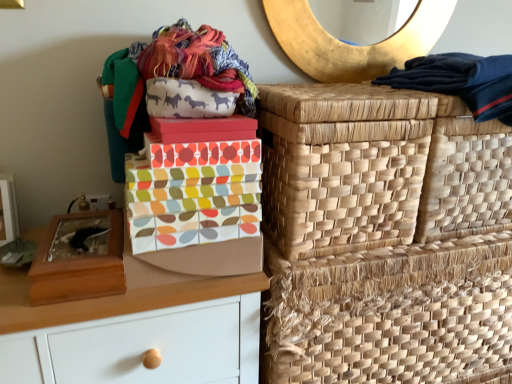
What do you see at coordinates (353, 46) in the screenshot? I see `gold textured mirror at upper center` at bounding box center [353, 46].

Identify the location of matte brown chest of drawers at left. (133, 333).

Find the location of a particular element. The width and height of the screenshot is (512, 384). dark blue fabric at upper right is located at coordinates 461,81.

What do you see at coordinates (198, 197) in the screenshot? I see `multicolored fabric shoe box at center, which is the second shoe box from left to right` at bounding box center [198, 197].

Describe the element at coordinates (465, 176) in the screenshot. I see `natural woven basket at upper right, placed as the 3th basket when sorted from bottom to top` at that location.

This screenshot has height=384, width=512. I want to click on natural woven basket at right, which is counted as the second basket, starting from the top, so click(x=342, y=165).

What do you see at coordinates (79, 260) in the screenshot? I see `wooden shoe box at left, the 2th shoe box in the right-to-left sequence` at bounding box center [79, 260].

Identify the location of wooden shoe box at left, which appears as the 1th shoe box when viewed from the left. The height and width of the screenshot is (384, 512). (79, 260).

What is the approximate height of natural woven basket at right, the 1th basket ordered from the bottom?

natural woven basket at right, the 1th basket ordered from the bottom, is 17.76 inches tall.

Identify the location of gold textured mirror at upper center. The image size is (512, 384). (353, 46).

From a real-world perspective, is matte brown chest of drawers at left physically located above or below natural woven basket at right, placed as the third basket when sorted from top to bottom?

matte brown chest of drawers at left is below natural woven basket at right, placed as the third basket when sorted from top to bottom.

Considering the relative sizes of matte brown chest of drawers at left and natural woven basket at right, the 1th basket ordered from the bottom, in the image provided, is matte brown chest of drawers at left smaller than natural woven basket at right, the 1th basket ordered from the bottom,?

Incorrect, matte brown chest of drawers at left is not smaller in size than natural woven basket at right, the 1th basket ordered from the bottom.

Do you think matte brown chest of drawers at left is within natural woven basket at right, placed as the third basket when sorted from top to bottom, or outside of it?

matte brown chest of drawers at left cannot be found inside natural woven basket at right, placed as the third basket when sorted from top to bottom.

Could you tell me if matte brown chest of drawers at left is facing natural woven basket at right, which ranks as the second basket in bottom-to-top order?

No, matte brown chest of drawers at left is not facing towards natural woven basket at right, which ranks as the second basket in bottom-to-top order.

Is matte brown chest of drawers at left bigger than natural woven basket at right, which ranks as the second basket in bottom-to-top order?

Indeed, matte brown chest of drawers at left has a larger size compared to natural woven basket at right, which ranks as the second basket in bottom-to-top order.

Considering the relative sizes of matte brown chest of drawers at left and natural woven basket at right, which is counted as the second basket, starting from the top, in the image provided, is matte brown chest of drawers at left thinner than natural woven basket at right, which is counted as the second basket, starting from the top,?

Incorrect, the width of matte brown chest of drawers at left is not less than that of natural woven basket at right, which is counted as the second basket, starting from the top.

From a real-world perspective, is matte brown chest of drawers at left above or below natural woven basket at right, which is counted as the second basket, starting from the top?

In terms of real-world spatial position, matte brown chest of drawers at left is below natural woven basket at right, which is counted as the second basket, starting from the top.

Is the surface of natural woven basket at right, placed as the third basket when sorted from top to bottom, in direct contact with matte brown chest of drawers at left?

No, natural woven basket at right, placed as the third basket when sorted from top to bottom, is not next to matte brown chest of drawers at left.

Can you confirm if natural woven basket at right, placed as the third basket when sorted from top to bottom, is positioned to the right of matte brown chest of drawers at left?

Indeed, natural woven basket at right, placed as the third basket when sorted from top to bottom, is positioned on the right side of matte brown chest of drawers at left.

Which of these two, natural woven basket at right, the 1th basket ordered from the bottom, or matte brown chest of drawers at left, is wider?

With larger width is natural woven basket at right, the 1th basket ordered from the bottom.

Is point (468, 367) positioned in front of point (106, 338)?

No, (468, 367) is further to viewer.

Looking at this image, is multicolored fabric shoe box at center, the first shoe box viewed from the right, with natural woven basket at right, the 1th basket ordered from the bottom?

No, multicolored fabric shoe box at center, the first shoe box viewed from the right, is not in contact with natural woven basket at right, the 1th basket ordered from the bottom.

Is point (259, 171) closer to camera compared to point (279, 295)?

That is True.

In terms of width, does multicolored fabric shoe box at center, which is the second shoe box from left to right, look wider or thinner when compared to natural woven basket at right, placed as the third basket when sorted from top to bottom?

In the image, multicolored fabric shoe box at center, which is the second shoe box from left to right, appears to be more narrow than natural woven basket at right, placed as the third basket when sorted from top to bottom.

Is dark blue fabric at upper right to the right of natural woven basket at right, placed as the third basket when sorted from top to bottom, from the viewer's perspective?

Correct, you'll find dark blue fabric at upper right to the right of natural woven basket at right, placed as the third basket when sorted from top to bottom.

There is a natural woven basket at right, the 1th basket ordered from the bottom. Where is `clothing above it (from a real-world perspective)`? clothing above it (from a real-world perspective) is located at coordinates (461, 81).

Who is taller, dark blue fabric at upper right or natural woven basket at right, placed as the third basket when sorted from top to bottom?

With more height is natural woven basket at right, placed as the third basket when sorted from top to bottom.

Find the location of a particular element. The height and width of the screenshot is (384, 512). the 1st shoe box counting from the left side of the gold textured mirror at upper center is located at coordinates (198, 197).

Can we say multicolored fabric shoe box at center, which is the second shoe box from left to right, lies outside gold textured mirror at upper center?

That's correct, multicolored fabric shoe box at center, which is the second shoe box from left to right, is outside of gold textured mirror at upper center.

Is multicolored fabric shoe box at center, the first shoe box viewed from the right, smaller than gold textured mirror at upper center?

Incorrect, multicolored fabric shoe box at center, the first shoe box viewed from the right, is not smaller in size than gold textured mirror at upper center.

Considering the sizes of multicolored fabric shoe box at center, which is the second shoe box from left to right, and gold textured mirror at upper center in the image, is multicolored fabric shoe box at center, which is the second shoe box from left to right, taller or shorter than gold textured mirror at upper center?

Clearly, multicolored fabric shoe box at center, which is the second shoe box from left to right, is shorter compared to gold textured mirror at upper center.

Considering the positions of objects wooden shoe box at left, which appears as the 1th shoe box when viewed from the left, and natural woven basket at right, the 1th basket ordered from the bottom, in the image provided, who is in front, wooden shoe box at left, which appears as the 1th shoe box when viewed from the left, or natural woven basket at right, the 1th basket ordered from the bottom,?

wooden shoe box at left, which appears as the 1th shoe box when viewed from the left, is closer to the camera.

Can you tell me how much wooden shoe box at left, which appears as the 1th shoe box when viewed from the left, and natural woven basket at right, the 1th basket ordered from the bottom, differ in facing direction?

They differ by 1.85 degrees in their facing directions.

How distant is wooden shoe box at left, the 2th shoe box in the right-to-left sequence, from natural woven basket at right, placed as the third basket when sorted from top to bottom?

wooden shoe box at left, the 2th shoe box in the right-to-left sequence, and natural woven basket at right, placed as the third basket when sorted from top to bottom, are 58.94 centimeters apart.

From a real-world perspective, is wooden shoe box at left, which appears as the 1th shoe box when viewed from the left, positioned under natural woven basket at right, the 1th basket ordered from the bottom, based on gravity?

No.

Identify the location of chest of drawers lying on the left of natural woven basket at right, the 1th basket ordered from the bottom. (133, 333).

From a real-world perspective, starting from the matte brown chest of drawers at left, which basket is the 3rd one vertically above it? Please provide its 2D coordinates.

[(342, 165)]

Estimate the real-world distances between objects in this image. Which object is closer to gold textured mirror at upper center, matte brown chest of drawers at left or dark blue fabric at upper right?

The object closer to gold textured mirror at upper center is dark blue fabric at upper right.

From the image, which object appears to be nearer to dark blue fabric at upper right, gold textured mirror at upper center or natural woven basket at right, placed as the third basket when sorted from top to bottom?

gold textured mirror at upper center is closer to dark blue fabric at upper right.

Looking at this image, when comparing their distances from natural woven basket at right, which ranks as the second basket in bottom-to-top order, does natural woven basket at upper right, marked as the 1th basket in a top-to-bottom arrangement, or multicolored fabric shoe box at center, which is the second shoe box from left to right, seem further?

Among the two, multicolored fabric shoe box at center, which is the second shoe box from left to right, is located further to natural woven basket at right, which ranks as the second basket in bottom-to-top order.

Which object lies further to the anchor point natural woven basket at upper right, placed as the 3th basket when sorted from bottom to top, natural woven basket at right, the 1th basket ordered from the bottom, or dark blue fabric at upper right?

Among the two, natural woven basket at right, the 1th basket ordered from the bottom, is located further to natural woven basket at upper right, placed as the 3th basket when sorted from bottom to top.

From the image, which object appears to be nearer to multicolored fabric shoe box at center, which is the second shoe box from left to right, dark blue fabric at upper right or natural woven basket at right, which is counted as the second basket, starting from the top?

natural woven basket at right, which is counted as the second basket, starting from the top, is closer to multicolored fabric shoe box at center, which is the second shoe box from left to right.

Which object lies nearer to the anchor point wooden shoe box at left, the 2th shoe box in the right-to-left sequence, natural woven basket at right, which ranks as the second basket in bottom-to-top order, or multicolored fabric shoe box at center, which is the second shoe box from left to right?

Among the two, multicolored fabric shoe box at center, which is the second shoe box from left to right, is located nearer to wooden shoe box at left, the 2th shoe box in the right-to-left sequence.

Which object lies nearer to the anchor point multicolored fabric shoe box at center, which is the second shoe box from left to right, matte brown chest of drawers at left or natural woven basket at right, placed as the third basket when sorted from top to bottom?

The object closer to multicolored fabric shoe box at center, which is the second shoe box from left to right, is matte brown chest of drawers at left.

Which object lies nearer to the anchor point wooden shoe box at left, which appears as the 1th shoe box when viewed from the left, dark blue fabric at upper right or natural woven basket at upper right, marked as the 1th basket in a top-to-bottom arrangement?

Based on the image, natural woven basket at upper right, marked as the 1th basket in a top-to-bottom arrangement, appears to be nearer to wooden shoe box at left, which appears as the 1th shoe box when viewed from the left.

Locate an element on the screen. the chest of drawers situated between wooden shoe box at left, the 2th shoe box in the right-to-left sequence, and dark blue fabric at upper right from left to right is located at coordinates (133, 333).

The width and height of the screenshot is (512, 384). What are the coordinates of `mirror situated between wooden shoe box at left, which appears as the 1th shoe box when viewed from the left, and dark blue fabric at upper right from left to right` in the screenshot? It's located at (353, 46).

The image size is (512, 384). I want to click on clothing between gold textured mirror at upper center and natural woven basket at upper right, placed as the 3th basket when sorted from bottom to top, in the vertical direction, so tap(461, 81).

At what (x,y) coordinates should I click in order to perform the action: click on shoe box between matte brown chest of drawers at left and natural woven basket at right, placed as the third basket when sorted from top to bottom, in the horizontal direction. Please return your answer as a coordinate pair (x, y). The width and height of the screenshot is (512, 384). Looking at the image, I should click on (198, 197).